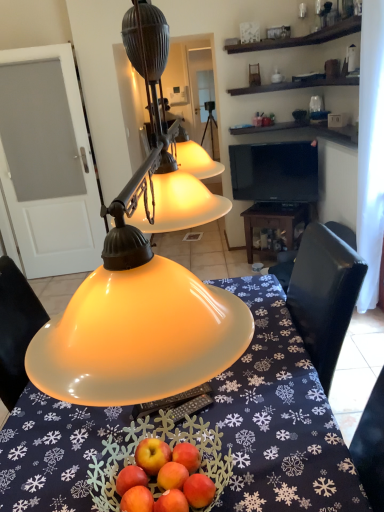
Question: From a real-world perspective, is wooden table at center on matte yellow glass lampshade at center?

Choices:
 (A) yes
 (B) no

Answer: (B)

Question: Does wooden table at center come behind matte yellow glass lampshade at center?

Choices:
 (A) no
 (B) yes

Answer: (B)

Question: Can you confirm if wooden table at center is thinner than matte yellow glass lampshade at center?

Choices:
 (A) yes
 (B) no

Answer: (B)

Question: Is wooden table at center turned away from matte yellow glass lampshade at center?

Choices:
 (A) no
 (B) yes

Answer: (A)

Question: Does wooden table at center have a larger size compared to matte yellow glass lampshade at center?

Choices:
 (A) no
 (B) yes

Answer: (A)

Question: In the image, is black glossy tv at upper center on the left side or the right side of wooden table at center?

Choices:
 (A) left
 (B) right

Answer: (A)

Question: Considering the positions of black glossy tv at upper center and wooden table at center in the image, is black glossy tv at upper center taller or shorter than wooden table at center?

Choices:
 (A) tall
 (B) short

Answer: (A)

Question: Considering their positions, is black glossy tv at upper center located in front of or behind wooden table at center?

Choices:
 (A) front
 (B) behind

Answer: (A)

Question: From the image's perspective, is black glossy tv at upper center above or below wooden table at center?

Choices:
 (A) below
 (B) above

Answer: (B)

Question: Is wooden table at center wider or thinner than translucent glass bowl at center?

Choices:
 (A) wide
 (B) thin

Answer: (B)

Question: In terms of size, does wooden table at center appear bigger or smaller than translucent glass bowl at center?

Choices:
 (A) big
 (B) small

Answer: (B)

Question: Considering their positions, is wooden table at center located in front of or behind translucent glass bowl at center?

Choices:
 (A) behind
 (B) front

Answer: (A)

Question: Based on their positions, is wooden table at center located to the left or right of translucent glass bowl at center?

Choices:
 (A) right
 (B) left

Answer: (A)

Question: Considering the positions of black glossy tv at upper center and matte yellow glass lampshade at center in the image, is black glossy tv at upper center wider or thinner than matte yellow glass lampshade at center?

Choices:
 (A) wide
 (B) thin

Answer: (B)

Question: From the image's perspective, is black glossy tv at upper center above or below matte yellow glass lampshade at center?

Choices:
 (A) below
 (B) above

Answer: (B)